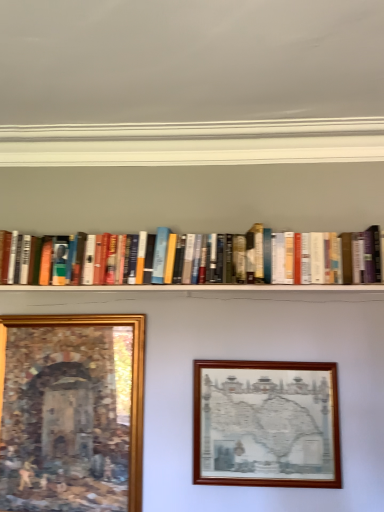
What do you see at coordinates (71, 412) in the screenshot? I see `gold-framed painting at lower left, the 1th picture frame viewed from the left` at bounding box center [71, 412].

Identify the location of hardcover books at center. The height and width of the screenshot is (512, 384). (325, 257).

From a real-world perspective, is hardcover books at center located higher than wooden picture frame at center, the first picture frame from the right?

Correct, in the physical world, hardcover books at center is higher than wooden picture frame at center, the first picture frame from the right.

In the scene shown: Which is closer to the camera, (293, 283) or (293, 368)?

Point (293, 283)

Does hardcover books at center have a lesser height compared to wooden picture frame at center, the 2th picture frame positioned from the left?

Indeed, hardcover books at center has a lesser height compared to wooden picture frame at center, the 2th picture frame positioned from the left.

Is hardcover books at center to the right of wooden picture frame at center, the first picture frame from the right, from the viewer's perspective?

No.

Does wooden picture frame at center, the 2th picture frame positioned from the left, have a greater height compared to hardcover books at center?

Correct, wooden picture frame at center, the 2th picture frame positioned from the left, is much taller as hardcover books at center.

In terms of width, does wooden picture frame at center, the 2th picture frame positioned from the left, look wider or thinner when compared to hardcover books at center?

Considering their sizes, wooden picture frame at center, the 2th picture frame positioned from the left, looks slimmer than hardcover books at center.

Does wooden picture frame at center, the first picture frame from the right, appear on the left side of hardcover books at center?

No, wooden picture frame at center, the first picture frame from the right, is not to the left of hardcover books at center.

How much distance is there between wooden picture frame at center, the first picture frame from the right, and hardcover books at center?

wooden picture frame at center, the first picture frame from the right, and hardcover books at center are 20.01 inches apart from each other.

Considering the sizes of objects hardcover books at center and gold-framed painting at lower left, the 1th picture frame viewed from the left, in the image provided, who is thinner, hardcover books at center or gold-framed painting at lower left, the 1th picture frame viewed from the left,?

Thinner between the two is gold-framed painting at lower left, the 1th picture frame viewed from the left.

From the image's perspective, between hardcover books at center and gold-framed painting at lower left, the 1th picture frame viewed from the left, who is located below?

gold-framed painting at lower left, the 1th picture frame viewed from the left, is shown below in the image.

Can you confirm if hardcover books at center is bigger than gold-framed painting at lower left, which is the second picture frame in right-to-left order?

Yes, hardcover books at center is bigger than gold-framed painting at lower left, which is the second picture frame in right-to-left order.

Between hardcover books at center and gold-framed painting at lower left, which is the second picture frame in right-to-left order, which one appears on the right side from the viewer's perspective?

From the viewer's perspective, hardcover books at center appears more on the right side.

Is point (124, 353) closer or farther from the camera than point (213, 415)?

Point (124, 353) is positioned farther from the camera compared to point (213, 415).

Between gold-framed painting at lower left, the 1th picture frame viewed from the left, and wooden picture frame at center, the first picture frame from the right, which one appears on the right side from the viewer's perspective?

From the viewer's perspective, wooden picture frame at center, the first picture frame from the right, appears more on the right side.

Is gold-framed painting at lower left, the 1th picture frame viewed from the left, surrounding wooden picture frame at center, the first picture frame from the right?

No, wooden picture frame at center, the first picture frame from the right, is not surrounded by gold-framed painting at lower left, the 1th picture frame viewed from the left.

Which object is more forward, gold-framed painting at lower left, which is the second picture frame in right-to-left order, or wooden picture frame at center, the first picture frame from the right?

wooden picture frame at center, the first picture frame from the right, is in front.

Considering their positions, is gold-framed painting at lower left, which is the second picture frame in right-to-left order, located in front of or behind hardcover books at center?

gold-framed painting at lower left, which is the second picture frame in right-to-left order, is positioned farther from the viewer than hardcover books at center.

Are gold-framed painting at lower left, which is the second picture frame in right-to-left order, and hardcover books at center far apart?

No, gold-framed painting at lower left, which is the second picture frame in right-to-left order, is not far away from hardcover books at center.

From the image's perspective, does gold-framed painting at lower left, which is the second picture frame in right-to-left order, appear higher than hardcover books at center?

No, from the image's perspective, gold-framed painting at lower left, which is the second picture frame in right-to-left order, is not on top of hardcover books at center.

Is point (73, 436) positioned behind point (349, 264)?

Yes, it is.

Does wooden picture frame at center, the 2th picture frame positioned from the left, lie behind gold-framed painting at lower left, which is the second picture frame in right-to-left order?

No, it is in front of gold-framed painting at lower left, which is the second picture frame in right-to-left order.

Based on the photo, from the image's perspective, is wooden picture frame at center, the first picture frame from the right, below gold-framed painting at lower left, the 1th picture frame viewed from the left?

Yes, from the image's perspective, wooden picture frame at center, the first picture frame from the right, is below gold-framed painting at lower left, the 1th picture frame viewed from the left.

Does wooden picture frame at center, the first picture frame from the right, have a lesser width compared to gold-framed painting at lower left, the 1th picture frame viewed from the left?

Yes, wooden picture frame at center, the first picture frame from the right, is thinner than gold-framed painting at lower left, the 1th picture frame viewed from the left.

Where is `book above the wooden picture frame at center, the 2th picture frame positioned from the left (from the image's perspective)`? book above the wooden picture frame at center, the 2th picture frame positioned from the left (from the image's perspective) is located at coordinates (325, 257).

Where is `book on the left of wooden picture frame at center, the first picture frame from the right`? This screenshot has height=512, width=384. book on the left of wooden picture frame at center, the first picture frame from the right is located at coordinates (325, 257).

Estimate the real-world distances between objects in this image. Which object is closer to wooden picture frame at center, the first picture frame from the right, gold-framed painting at lower left, the 1th picture frame viewed from the left, or hardcover books at center?

The object closer to wooden picture frame at center, the first picture frame from the right, is gold-framed painting at lower left, the 1th picture frame viewed from the left.

From the image, which object appears to be farther from gold-framed painting at lower left, which is the second picture frame in right-to-left order, hardcover books at center or wooden picture frame at center, the first picture frame from the right?

hardcover books at center is further to gold-framed painting at lower left, which is the second picture frame in right-to-left order.

Looking at the image, which one is located further to wooden picture frame at center, the first picture frame from the right, hardcover books at center or gold-framed painting at lower left, which is the second picture frame in right-to-left order?

The object further to wooden picture frame at center, the first picture frame from the right, is hardcover books at center.

Looking at the image, which one is located closer to hardcover books at center, wooden picture frame at center, the first picture frame from the right, or gold-framed painting at lower left, which is the second picture frame in right-to-left order?

wooden picture frame at center, the first picture frame from the right, is closer to hardcover books at center.

Looking at the image, which one is located further to gold-framed painting at lower left, the 1th picture frame viewed from the left, wooden picture frame at center, the 2th picture frame positioned from the left, or hardcover books at center?

Based on the image, hardcover books at center appears to be further to gold-framed painting at lower left, the 1th picture frame viewed from the left.

Looking at the image, which one is located closer to hardcover books at center, gold-framed painting at lower left, the 1th picture frame viewed from the left, or wooden picture frame at center, the first picture frame from the right?

Based on the image, wooden picture frame at center, the first picture frame from the right, appears to be nearer to hardcover books at center.

You are a GUI agent. You are given a task and a screenshot of the screen. Output one action in this format:
    pyautogui.click(x=<x>, y=<y>)
    Task: Click on the book between gold-framed painting at lower left, the 1th picture frame viewed from the left, and wooden picture frame at center, the first picture frame from the right, in the horizontal direction
    
    Given the screenshot: What is the action you would take?
    pyautogui.click(x=325, y=257)